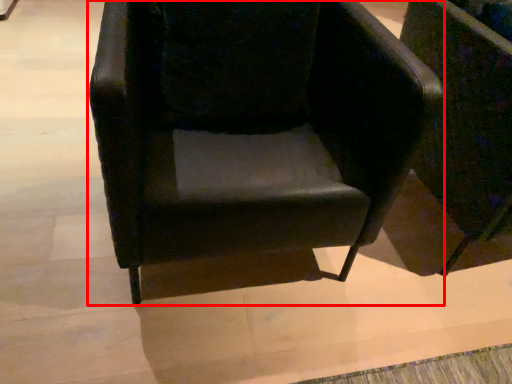
Question: From the image's perspective, considering the relative positions of chair (annotated by the red box) and chair in the image provided, where is chair (annotated by the red box) located with respect to the staircase?

Choices:
 (A) above
 (B) below

Answer: (B)